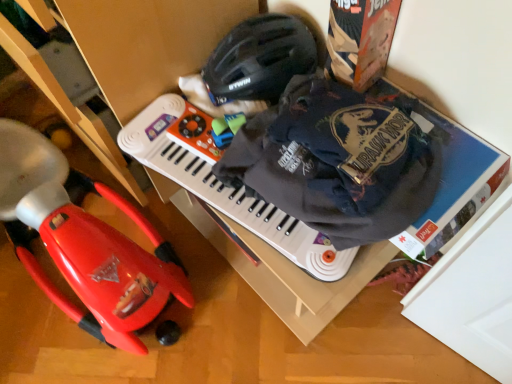
Question: Is red plastic toy car at left turned away from black matte helmet at upper center?

Choices:
 (A) yes
 (B) no

Answer: (B)

Question: Can you confirm if red plastic toy car at left is bigger than black matte helmet at upper center?

Choices:
 (A) no
 (B) yes

Answer: (B)

Question: From the image's perspective, does red plastic toy car at left appear lower than black matte helmet at upper center?

Choices:
 (A) yes
 (B) no

Answer: (A)

Question: Are red plastic toy car at left and black matte helmet at upper center far apart?

Choices:
 (A) yes
 (B) no

Answer: (B)

Question: From a real-world perspective, is red plastic toy car at left under black matte helmet at upper center?

Choices:
 (A) yes
 (B) no

Answer: (A)

Question: Is red plastic toy car at left shorter than black matte helmet at upper center?

Choices:
 (A) no
 (B) yes

Answer: (A)

Question: Can you confirm if black matte helmet at upper center is bigger than dark blue cotton t-shirt at upper right?

Choices:
 (A) yes
 (B) no

Answer: (B)

Question: Is black matte helmet at upper center in contact with dark blue cotton t-shirt at upper right?

Choices:
 (A) yes
 (B) no

Answer: (B)

Question: Considering the relative sizes of black matte helmet at upper center and dark blue cotton t-shirt at upper right in the image provided, is black matte helmet at upper center smaller than dark blue cotton t-shirt at upper right?

Choices:
 (A) yes
 (B) no

Answer: (A)

Question: Does black matte helmet at upper center appear on the right side of dark blue cotton t-shirt at upper right?

Choices:
 (A) yes
 (B) no

Answer: (B)

Question: Is black matte helmet at upper center far away from dark blue cotton t-shirt at upper right?

Choices:
 (A) no
 (B) yes

Answer: (A)

Question: Does black matte helmet at upper center turn towards dark blue cotton t-shirt at upper right?

Choices:
 (A) no
 (B) yes

Answer: (A)

Question: Would you say red plastic toy car at left is part of dark blue cotton t-shirt at upper right's contents?

Choices:
 (A) no
 (B) yes

Answer: (A)